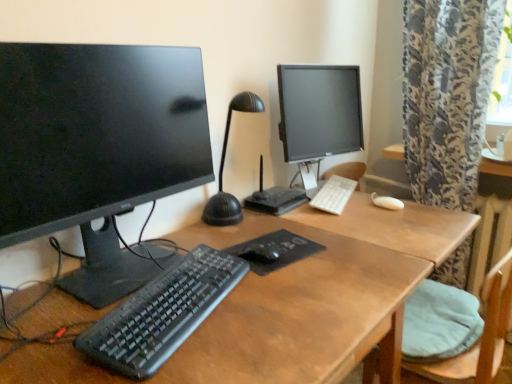
Question: Should I look upward or downward to see wooden desk at center?

Choices:
 (A) up
 (B) down

Answer: (B)

Question: Considering the relative sizes of black textured mousepad at center and black plastic keyboard at center, the 1th computer keyboard in the front-to-back sequence, in the image provided, is black textured mousepad at center smaller than black plastic keyboard at center, the 1th computer keyboard in the front-to-back sequence,?

Choices:
 (A) no
 (B) yes

Answer: (B)

Question: Is black textured mousepad at center oriented away from black plastic keyboard at center, which appears as the second computer keyboard when viewed from the right?

Choices:
 (A) no
 (B) yes

Answer: (A)

Question: From the image's perspective, is black textured mousepad at center located above black plastic keyboard at center, which appears as the second computer keyboard when viewed from the right?

Choices:
 (A) no
 (B) yes

Answer: (B)

Question: From the image's perspective, does black textured mousepad at center appear lower than black plastic keyboard at center, placed as the second computer keyboard when sorted from top to bottom?

Choices:
 (A) yes
 (B) no

Answer: (B)

Question: From a real-world perspective, is black textured mousepad at center under black plastic keyboard at center, the 1th computer keyboard in the front-to-back sequence?

Choices:
 (A) no
 (B) yes

Answer: (B)

Question: Is black textured mousepad at center facing towards black plastic keyboard at center, the 1th computer keyboard in the front-to-back sequence?

Choices:
 (A) yes
 (B) no

Answer: (B)

Question: Can you confirm if white plastic keyboard at center, which appears as the 1th computer keyboard when viewed from the back, is wider than matte black monitor at left, the first computer monitor when ordered from left to right?

Choices:
 (A) no
 (B) yes

Answer: (A)

Question: From the image's perspective, is white plastic keyboard at center, which appears as the 1th computer keyboard when viewed from the back, under matte black monitor at left, the first computer monitor when ordered from left to right?

Choices:
 (A) yes
 (B) no

Answer: (A)

Question: Is white plastic keyboard at center, which appears as the second computer keyboard when viewed from the front, touching matte black monitor at left, which is the 1th computer monitor from front to back?

Choices:
 (A) yes
 (B) no

Answer: (B)

Question: Can you confirm if white plastic keyboard at center, which appears as the 2th computer keyboard when viewed from the left, is thinner than matte black monitor at left, the first computer monitor when ordered from left to right?

Choices:
 (A) no
 (B) yes

Answer: (B)

Question: Is white plastic keyboard at center, which appears as the second computer keyboard when viewed from the front, further to camera compared to matte black monitor at left, placed as the 2th computer monitor when sorted from back to front?

Choices:
 (A) yes
 (B) no

Answer: (A)

Question: Can you confirm if white plastic keyboard at center, which is counted as the first computer keyboard, starting from the top, is positioned to the left of matte black monitor at left, which is the 1th computer monitor from front to back?

Choices:
 (A) yes
 (B) no

Answer: (B)

Question: Does white plastic keyboard at center, which appears as the second computer keyboard when viewed from the front, have a lesser width compared to matte black monitor at center, the 1th computer monitor viewed from the back?

Choices:
 (A) yes
 (B) no

Answer: (A)